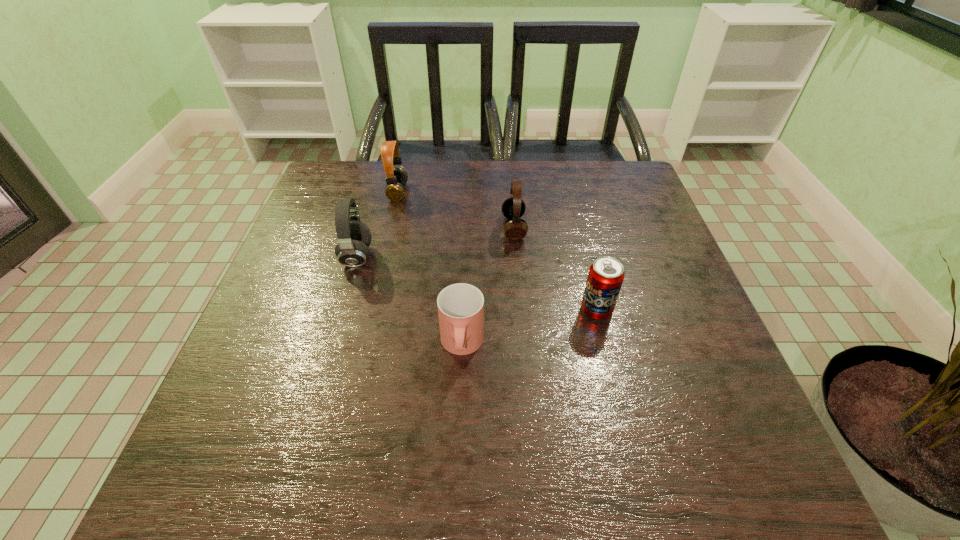
In order to click on vacant point located on the side of the shortest object with the handle in this screenshot , I will do `click(458, 458)`.

This screenshot has width=960, height=540. In order to click on object that is at the far edge in this screenshot , I will do `click(396, 178)`.

At what (x,y) coordinates should I click in order to perform the action: click on object at the left edge. Please return your answer as a coordinate pair (x, y). The height and width of the screenshot is (540, 960). Looking at the image, I should click on (354, 237).

Where is `vacant area at the far edge of the desktop`? The width and height of the screenshot is (960, 540). vacant area at the far edge of the desktop is located at coordinates (527, 175).

Locate an element on the screen. This screenshot has width=960, height=540. free space at the near edge of the desktop is located at coordinates (654, 498).

You are a GUI agent. You are given a task and a screenshot of the screen. Output one action in this format:
    pyautogui.click(x=<x>, y=<y>)
    Task: Click on the vacant space at the left edge of the desktop
    The height and width of the screenshot is (540, 960).
    Given the screenshot: What is the action you would take?
    pyautogui.click(x=335, y=279)

Identify the location of vacant space at the right edge of the desktop. Image resolution: width=960 pixels, height=540 pixels. (720, 359).

Find the location of `free space at the far left corner`. free space at the far left corner is located at coordinates (345, 176).

This screenshot has width=960, height=540. What are the coordinates of `vacant space at the near left corner of the desktop` in the screenshot? It's located at (277, 472).

In the image, there is a desktop. At what (x,y) coordinates should I click in order to perform the action: click on vacant space at the far right corner. Please return your answer as a coordinate pair (x, y). The width and height of the screenshot is (960, 540). Looking at the image, I should click on (608, 205).